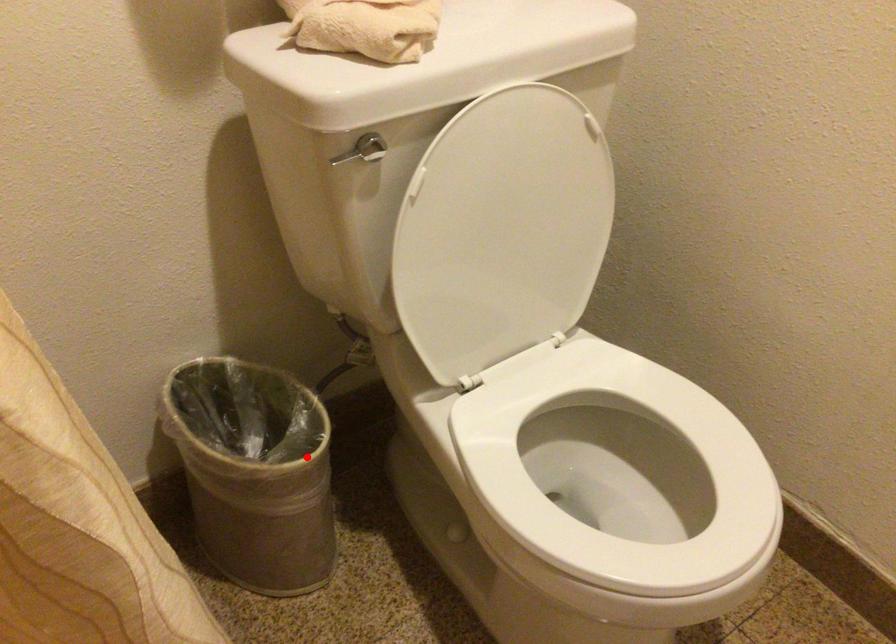
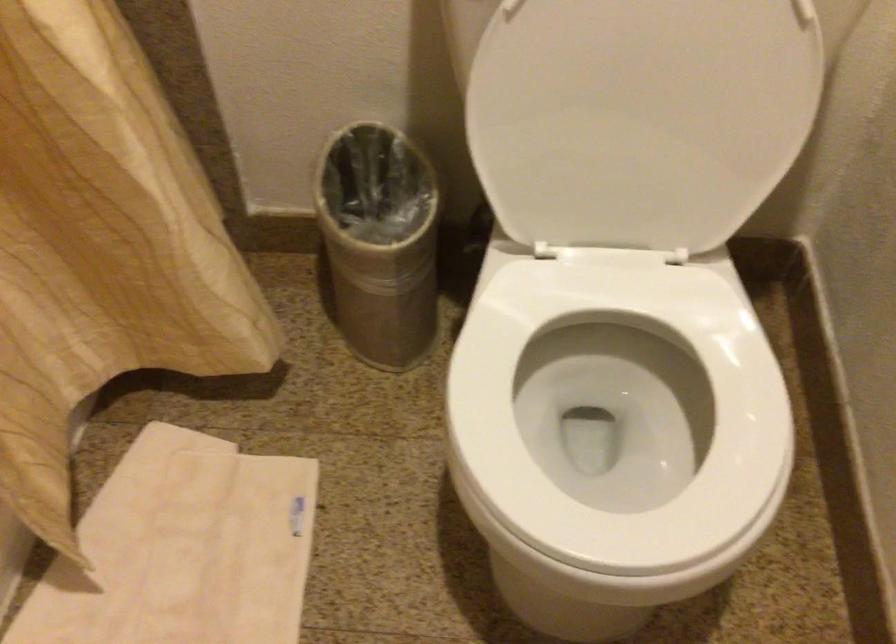
In the second image, find the point that corresponds to the highlighted location in the first image.

(380, 242)